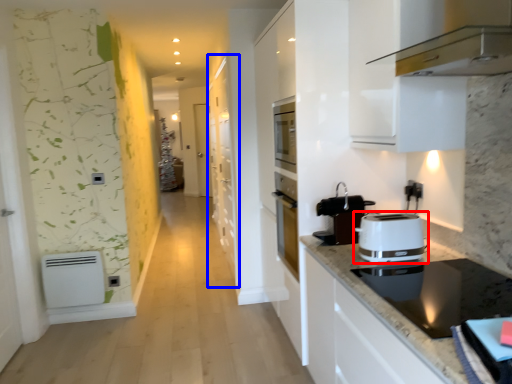
Question: Among these objects, which one is farthest to the camera, toaster (highlighted by a red box) or cabinetry (highlighted by a blue box)?

Choices:
 (A) toaster
 (B) cabinetry

Answer: (B)